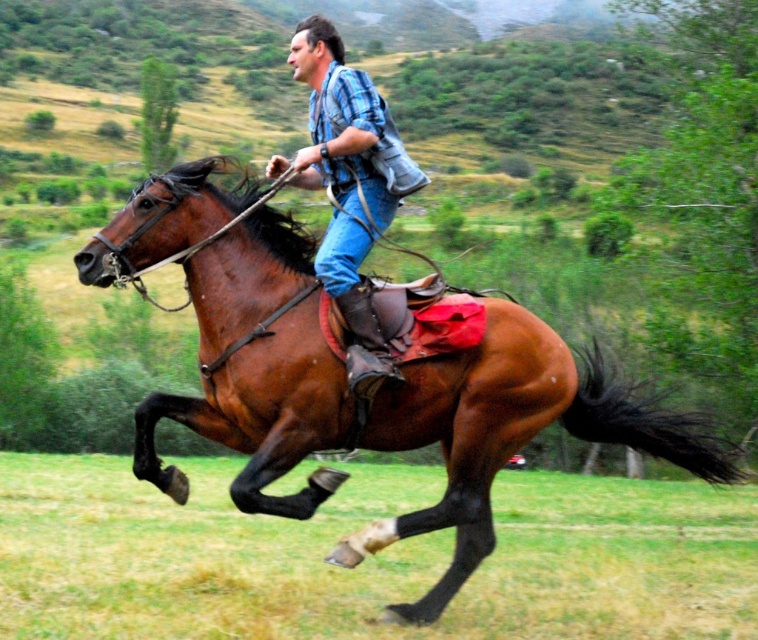
You are a photographer standing at the origin point of the image. You want to capture a photo of the brown leather horse at center. Where should you position your camera to ensure the horse is centered in your shot?

To center the brown leather horse at center in your photo, position your camera at the coordinates specified by the 2D location point provided, which is at point (509, 433).

From the picture: You are a photographer trying to capture the horse and rider in the image. To ensure the green grass at lower center is in the foreground, where should you position your camera relative to the horse and rider?

The green grass at lower center is located at point [367,557] in the 2D image. To place it in the foreground, position the camera closer to the grass and behind the horse and rider so they appear behind the grass in the frame.